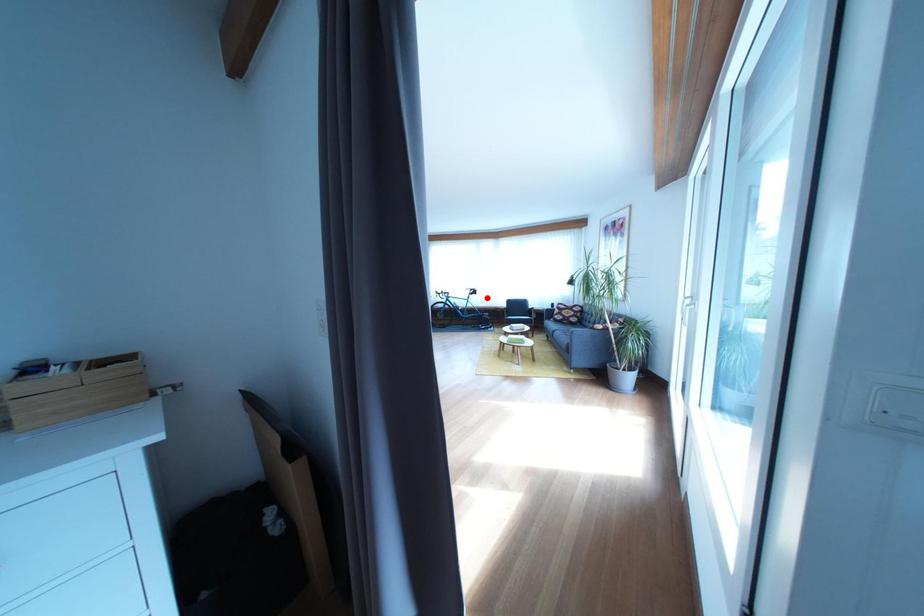
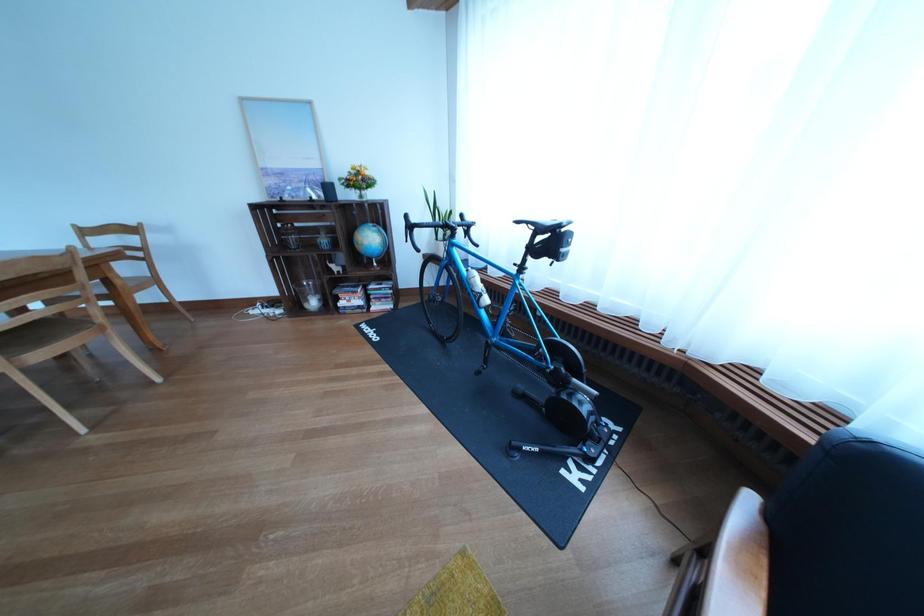
The point at the highlighted location is marked in the first image. Where is the corresponding point in the second image?

(563, 248)